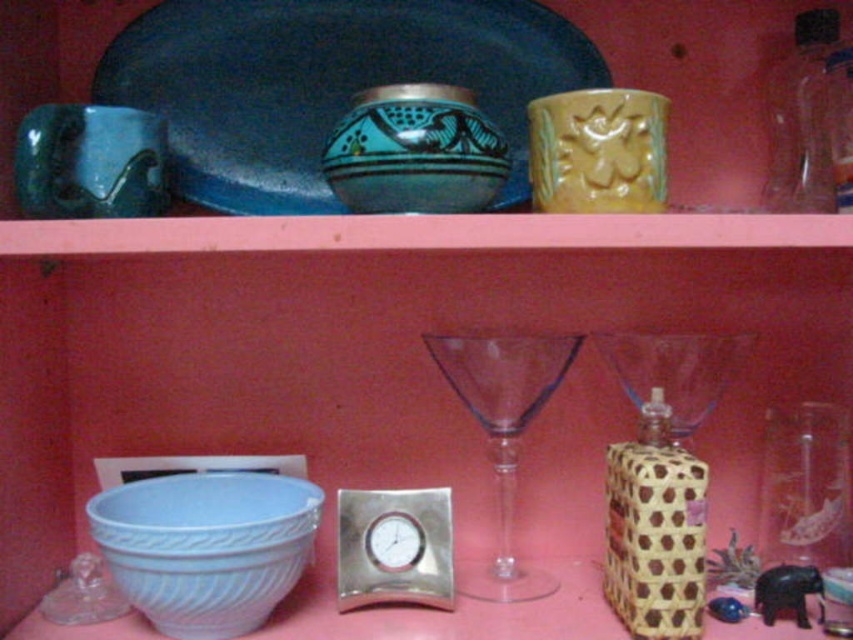
At what (x,y) coordinates should I click in order to perform the action: click on yellow matte cup at upper center. Please return your answer as a coordinate pair (x, y). The width and height of the screenshot is (853, 640). Looking at the image, I should click on (598, 150).

Is yellow matte cup at upper center to the left of transparent plastic bottle at upper right from the viewer's perspective?

Correct, you'll find yellow matte cup at upper center to the left of transparent plastic bottle at upper right.

Is point (627, 156) farther from viewer compared to point (824, 84)?

No.

Image resolution: width=853 pixels, height=640 pixels. Find the location of `yellow matte cup at upper center`. yellow matte cup at upper center is located at coordinates (598, 150).

Is transparent glass wine glass at center shorter than transparent plastic bottle at upper right?

No.

Is transparent glass wine glass at center below transparent plastic bottle at upper right?

Yes.

Where is `transparent glass wine glass at center`? Image resolution: width=853 pixels, height=640 pixels. transparent glass wine glass at center is located at coordinates [x=503, y=435].

Is brown woven bottle at lower right further to camera compared to yellow matte cup at upper center?

Yes, brown woven bottle at lower right is further from the viewer.

Who is more forward, (x=682, y=628) or (x=550, y=186)?

Point (x=550, y=186) is in front.

I want to click on brown woven bottle at lower right, so click(x=654, y=529).